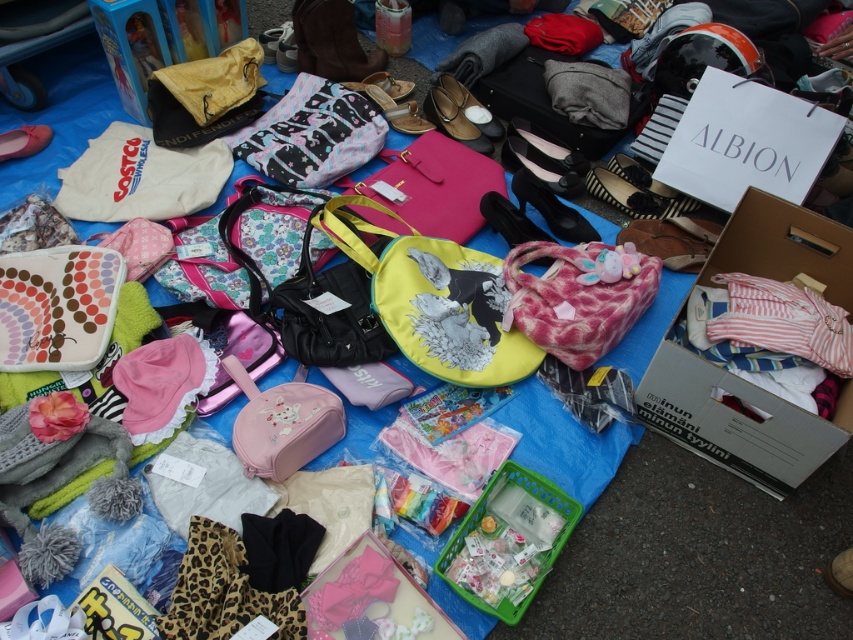
Does matte fabric bag at center-left come in front of pink fabric purse at center?

No, it is not.

Describe the element at coordinates (57, 307) in the screenshot. I see `matte fabric bag at center-left` at that location.

Identify the location of matte fabric bag at center-left. (57, 307).

Can you confirm if yellow fabric bag at center is bigger than matte pink fabric bag at center?

Yes.

Which is in front, point (396, 276) or point (259, 132)?

Point (396, 276) is in front.

Find the location of a particular element. The image size is (853, 640). yellow fabric bag at center is located at coordinates (434, 300).

Does fluffy pink bag at center have a larger size compared to matte pink fabric bag at center?

Actually, fluffy pink bag at center might be smaller than matte pink fabric bag at center.

The height and width of the screenshot is (640, 853). I want to click on fluffy pink bag at center, so coord(575,300).

You are a GUI agent. You are given a task and a screenshot of the screen. Output one action in this format:
    pyautogui.click(x=<x>, y=<y>)
    Task: Click on the fluffy pink bag at center
    Image resolution: width=853 pixels, height=640 pixels.
    Given the screenshot: What is the action you would take?
    pyautogui.click(x=575, y=300)